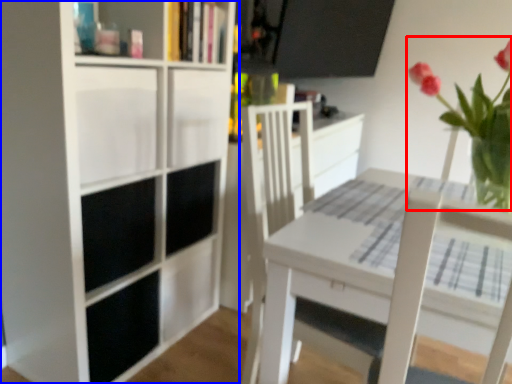
Question: Which point is closer to the camera, floral arrangement (highlighted by a red box) or bookcase (highlighted by a blue box)?

Choices:
 (A) floral arrangement
 (B) bookcase

Answer: (A)